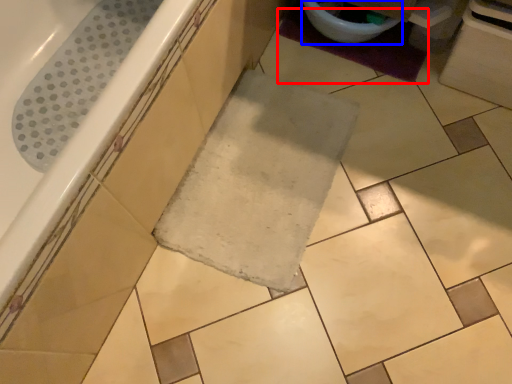
Question: Which point is further to the camera, bath mat (highlighted by a red box) or toilet bowl (highlighted by a blue box)?

Choices:
 (A) bath mat
 (B) toilet bowl

Answer: (A)